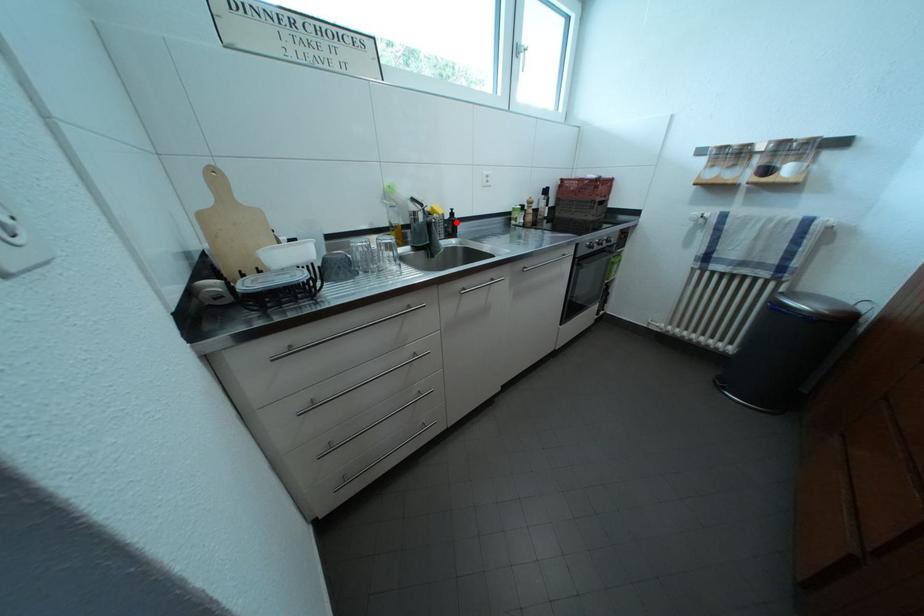
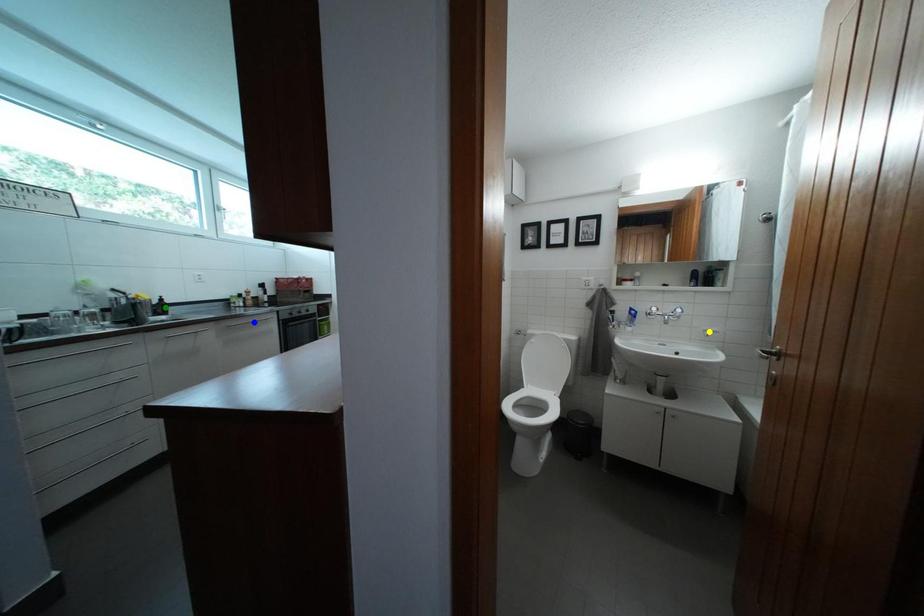
Question: I am providing you with two images of the same scene from different viewpoints. A red point is marked on the first image. You are given multiple points on the second image. Which spot in image 2 lines up with the point in image 1?

Choices:
 (A) green point
 (B) blue point
 (C) yellow point

Answer: (A)